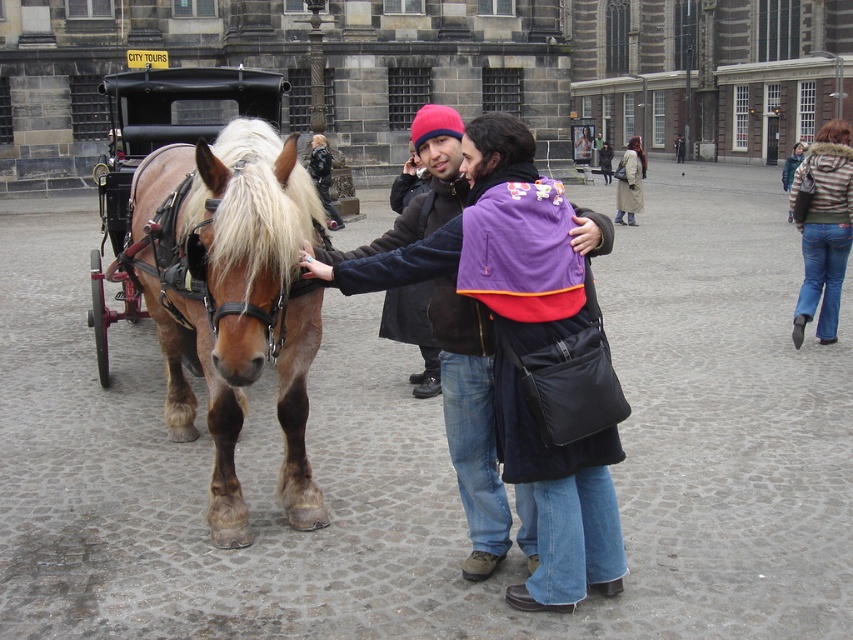
You are standing on the cobblestone street and want to walk towards the horse. There are two points marked in the image. Which point, point 1 at coordinates (x=160, y=150) or point 2 at coordinates (x=129, y=113), is closer to you as you face the horse?

Point 1 at coordinates (x=160, y=150) is closer to you because it is closer to the viewer than point 2 at coordinates (x=129, y=113).

You are a tour guide standing in the middle of the cobblestone street. You need to place a new bench in the scene so that it doesn not block the path between the brown glossy horse at left and the matte black coat at center. Given the space each occupies, where should you place the bench?

The bench should be placed either behind the brown glossy horse at left or in front of the matte black coat at center since the brown glossy horse at left occupies less space than the matte black coat at center, leaving more space between them to avoid blocking the path.

You are a tour guide standing on the cobblestone street. You need to place a new bench between the brown glossy horse at left and the matte black coat at center. Which side of the bench should face the wider object?

The bench should face the brown glossy horse at left because it is wider than the matte black coat at center according to the description.